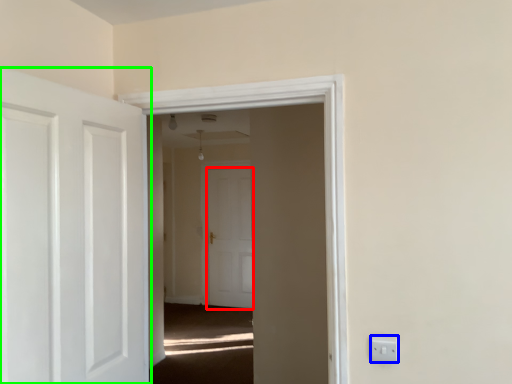
Question: Which object is positioned closest to door (highlighted by a red box)? Select from electric outlet (highlighted by a blue box) and door (highlighted by a green box).

Choices:
 (A) electric outlet
 (B) door

Answer: (B)